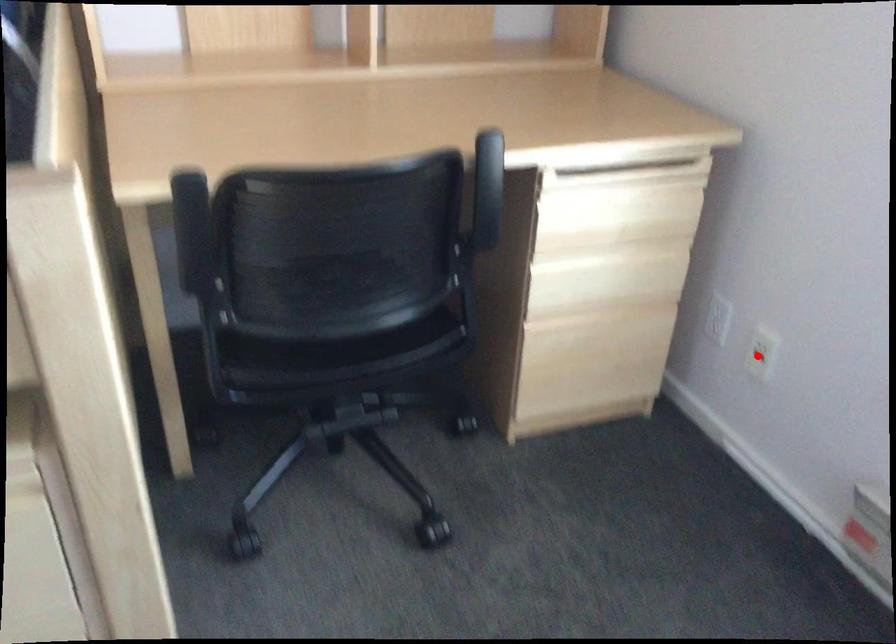
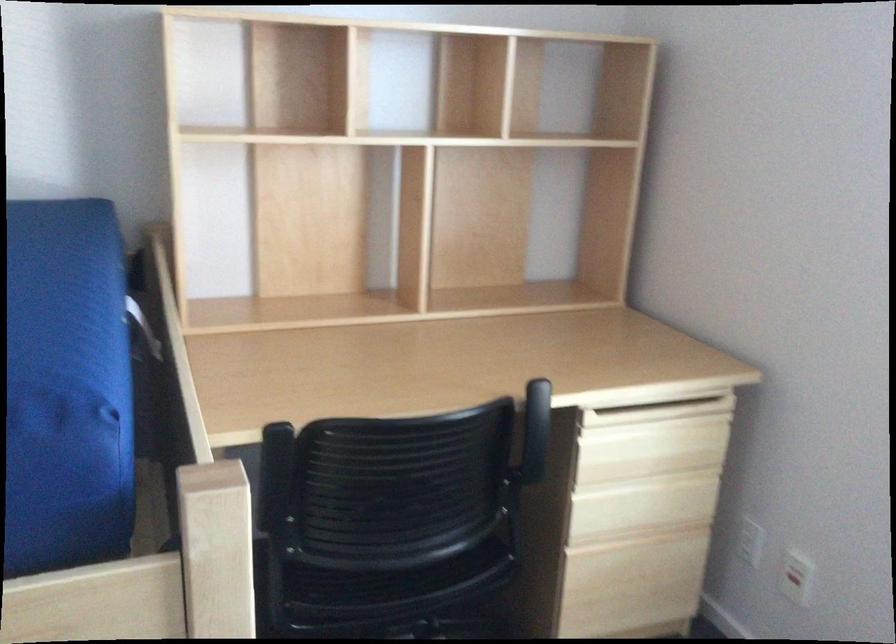
Question: I am providing you with two images of the same scene from different viewpoints. A red point is marked on the first image. Is the red point's position out of view in image 2?

Choices:
 (A) Yes
 (B) No

Answer: (B)